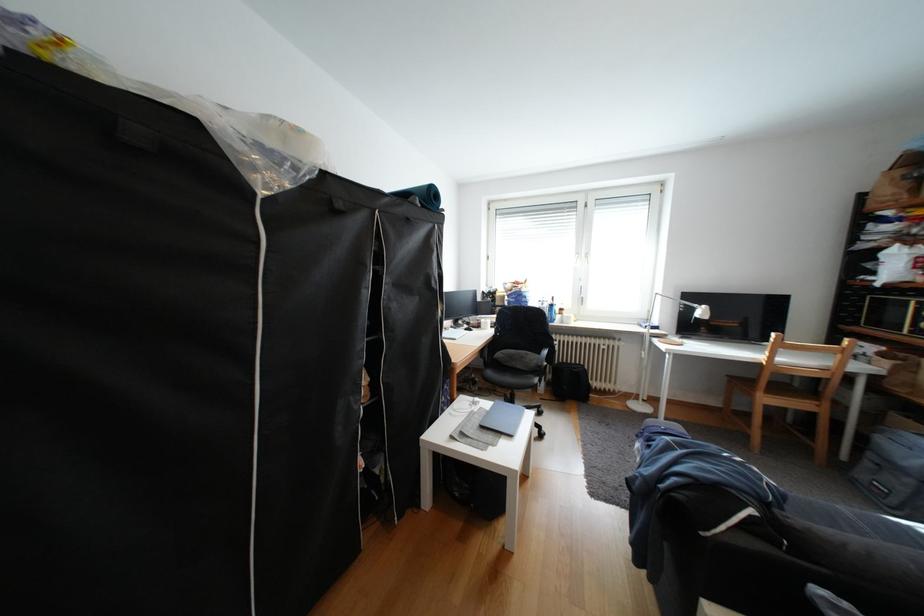
Find where to lift the black backpack. Please return your answer as a coordinate pair (x, y).

(569, 382)